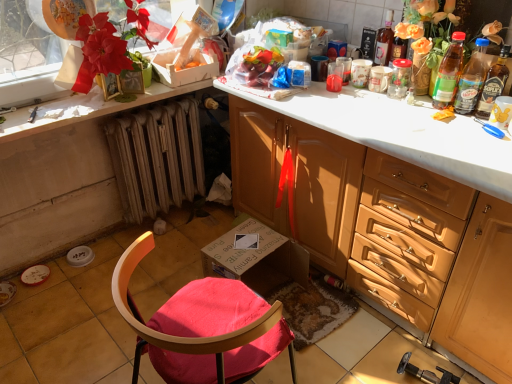
Find the location of `vacant area situated to the left side of translucent plastic bottle at upper right, which is counted as the 2th bottle, starting from the right`. vacant area situated to the left side of translucent plastic bottle at upper right, which is counted as the 2th bottle, starting from the right is located at coordinates (425, 105).